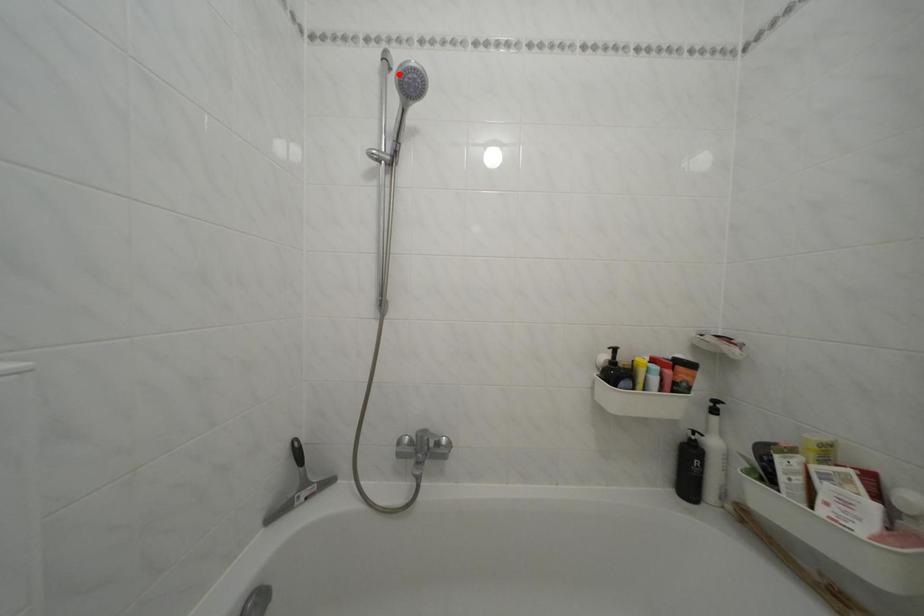
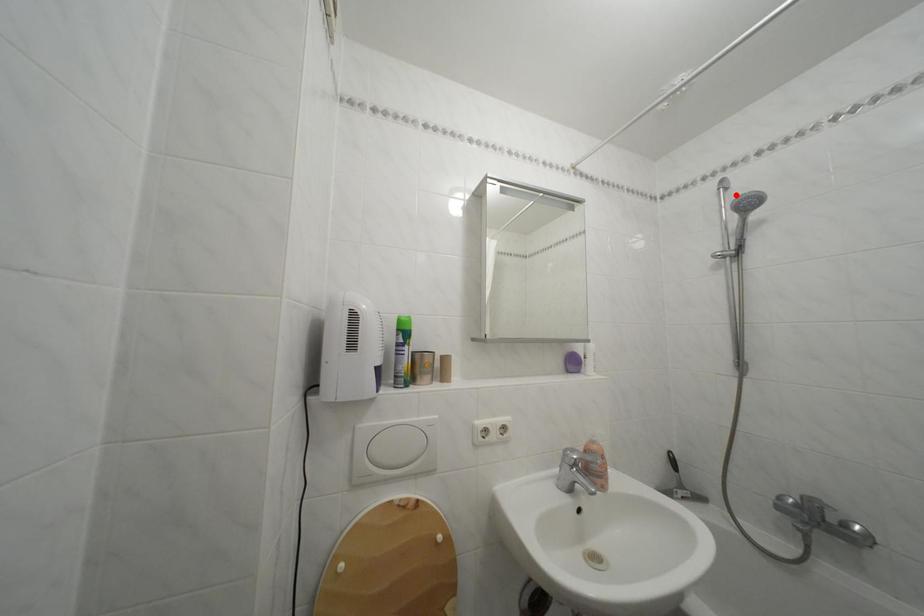
I am providing you with two images of the same scene from different viewpoints. A red point is marked on the first image and another point is marked on the second image. Is the marked point in image1 the same physical position as the marked point in image2?

Yes